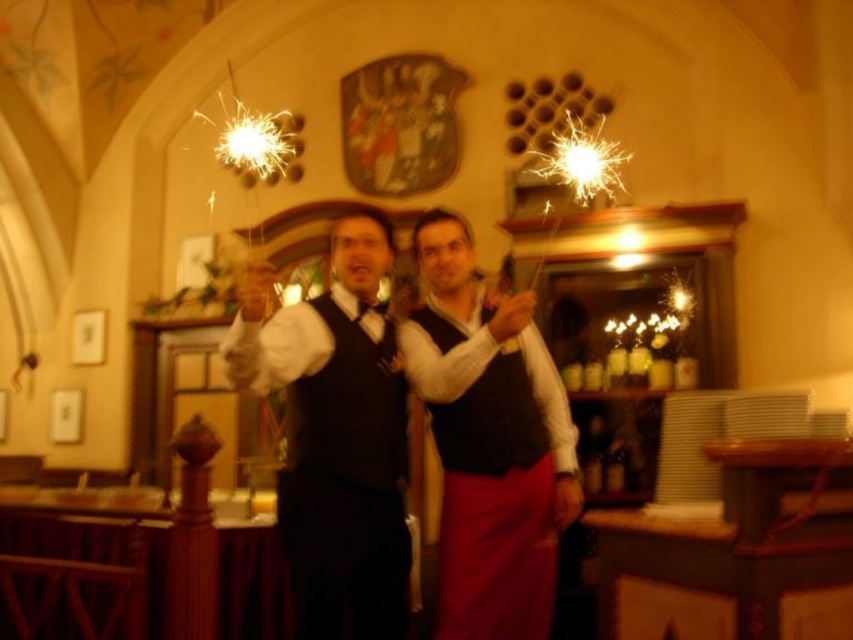
You are a costume designer preparing for a play and need to choose between the matte black vest at center and the black velvet vest at center. The actor has a narrow torso. Which vest would you recommend based on their body type?

The matte black vest at center has a smaller width than the black velvet vest at center, so it would be more suitable for someone with a narrow torso as it fits closer to the body.

You are a guest at the event and want to know which vest is visible on top between the matte black vests at center and the black velvet vest at center. Based on the scene description, can you tell me which one is on top?

The matte black vests at center is positioned over black velvet vest at center, so the matte black vests at center is visible on top.

You are a fashion designer observing two vests in the image. The first is a matte black vest at center, and the second is a black velvet vest at center. Which vest is taller?

The matte black vest at center is taller than the black velvet vest at center.